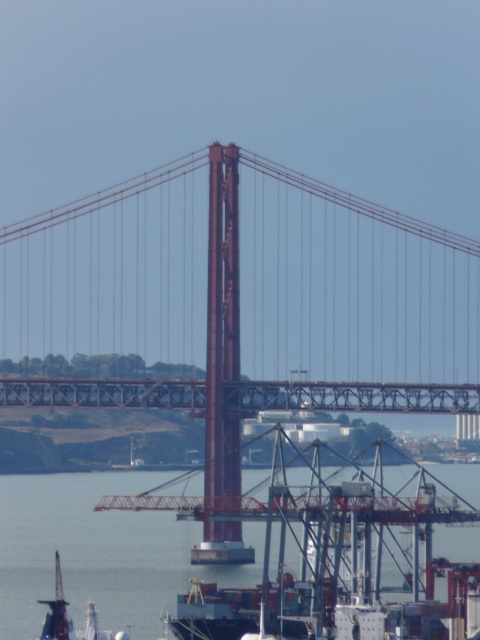
From the picture: You are a delivery truck driver who needs to cross the red metal suspension bridge at center to reach the port area near the gray metallic water at lower center. Can you safely cross the bridge if your truck requires a minimum clearance of 120 feet above the water level?

The red metal suspension bridge at center is only 114.20 feet above the gray metallic water at lower center, which is below the required 120 feet clearance. Therefore, the truck cannot safely cross the bridge.

You are a delivery truck driver who needs to cross the red metal suspension bridge at center. However, your truck has a height restriction of 15 meters. Can you safely pass under the bridge without hitting the gray metallic water at lower center?

The red metal suspension bridge at center is located above the gray metallic water at lower center, so the truck can safely pass under the bridge as there is sufficient vertical clearance between the truck and the bridge structure.

You are standing at the port area near the red metal suspension bridge at center and the gray metallic water at lower center. Which object is nearer to you?

The red metal suspension bridge at center is closer to the viewer than the gray metallic water at lower center, so the red metal suspension bridge at center is nearer to you.